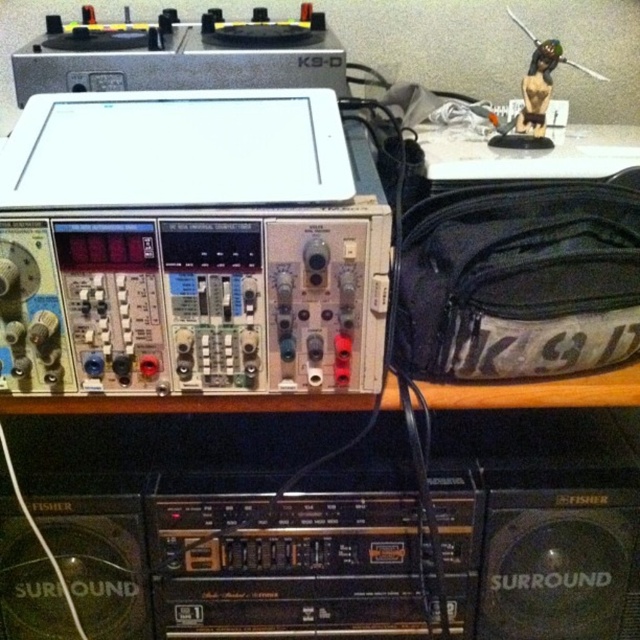
You are setting up a home theater system and need to place the black plastic speaker at lower right and the matte black statue at upper right on a shelf. Which object should be placed closer to the ceiling to ensure proper height alignment?

The black plastic speaker at lower right is taller than the matte black statue at upper right, so to ensure proper height alignment, the black plastic speaker at lower right should be placed closer to the ceiling.

You are setting up an audio system and need to place a 22 inch cable between the black plastic speaker at lower right and the matte black statue at upper right. Will the cable be long enough?

The distance between the black plastic speaker at lower right and the matte black statue at upper right is 21.49 inches. Since the cable is 22 inches long, it will be long enough to connect them.